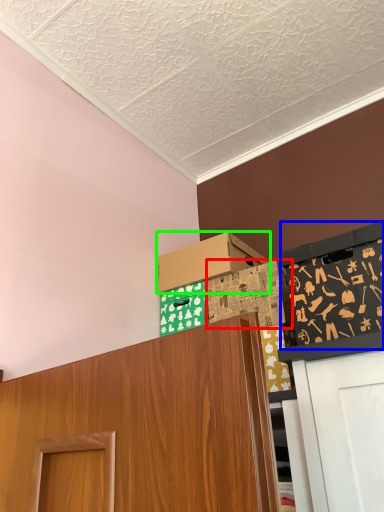
Question: Estimate the real-world distances between objects in this image. Which object is closer to box (highlighted by a red box), bulletin board (highlighted by a blue box) or box (highlighted by a green box)?

Choices:
 (A) bulletin board
 (B) box

Answer: (B)